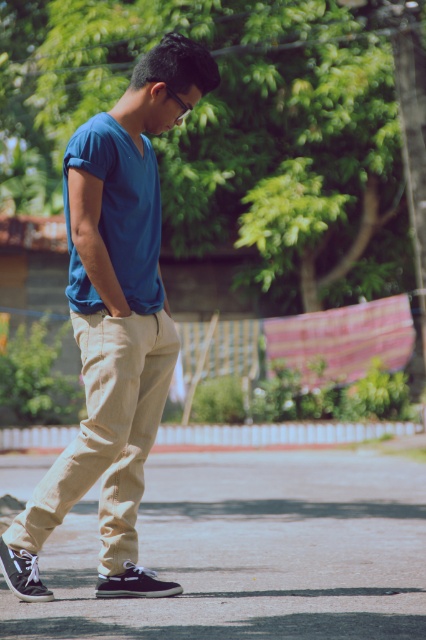
You are standing at the point marked as point (250,552) in the image. What material is directly beneath your feet?

The material directly beneath your feet at point (250,552) is matte asphalt pavement at lower center.

You are trying to decide whether to place a small potted plant between the matte asphalt pavement at lower center and the matte blue shirt at center. Based on their widths, which object should the plant be placed next to?

The matte asphalt pavement at lower center might be wider than matte blue shirt at center, so the plant should be placed next to the matte asphalt pavement at lower center to ensure it has enough space.

You are a photographer adjusting your camera settings to capture the scene. The matte asphalt pavement at lower center and the matte blue shirt at center are both in the frame. How far apart are these two objects in meters?

The matte asphalt pavement at lower center is 3.65 meters from matte blue shirt at center.